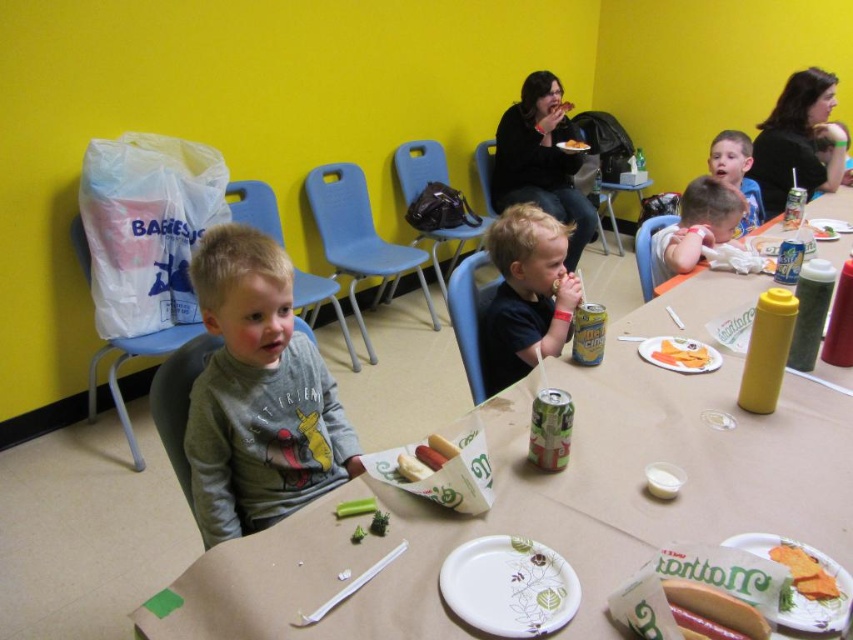
You are standing at the entrance of the dining area and want to walk towards the point at coordinates point [697,630]. There is an obstacle at point [403,452]. Will you pass by the obstacle before reaching your destination?

Yes, you will pass by the obstacle at point [403,452] before reaching your destination at point [697,630] because point [697,630] is in front of point [403,452].

You are a photographer standing behind the matte gray table at center and want to take a photo of the smooth white hot dog at lower right. Can you see the hot dog clearly without moving your position?

The smooth white hot dog at lower right is behind the matte gray table at center, so you cannot see it clearly from your current position behind the table.

You are a parent trying to decide which food item to offer your child first. The smooth white hot dog at lower right and the yellow matte carrot at center are both on the table. Which one is closer to your child?

The smooth white hot dog at lower right is positioned under the yellow matte carrot at center, so the yellow matte carrot at center is closer to the child.